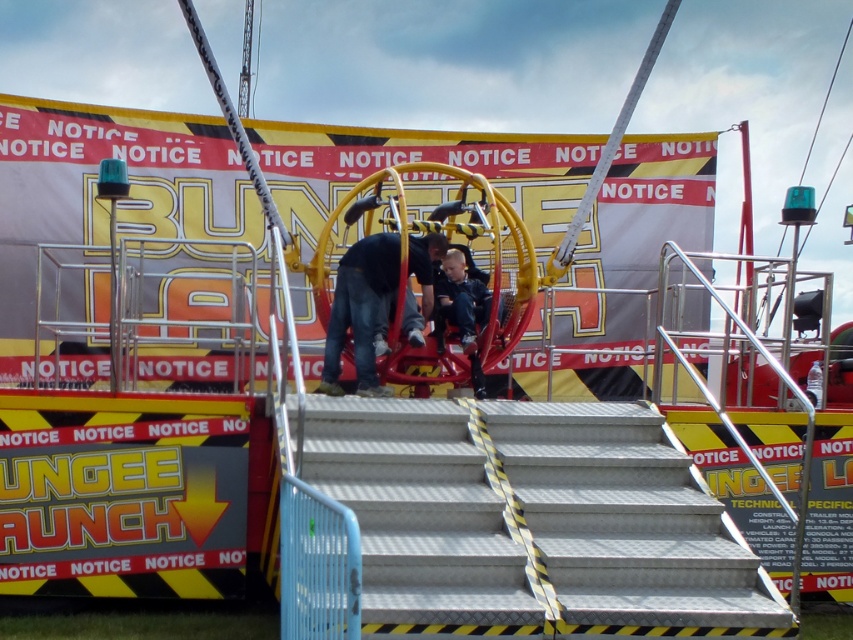
You are organizing a clothing display and need to place the denim jeans at center and dark blue jeans at center side by side on a narrow shelf. Which pair should you place first to ensure they both fit?

The dark blue jeans at center should be placed first since its narrower width allows more space for the wider denim jeans at center to fit alongside.